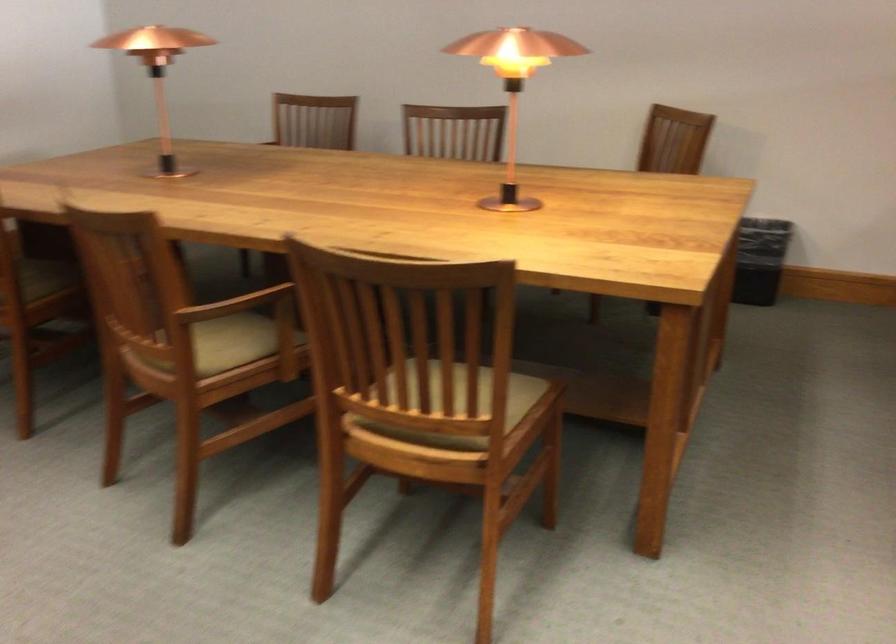
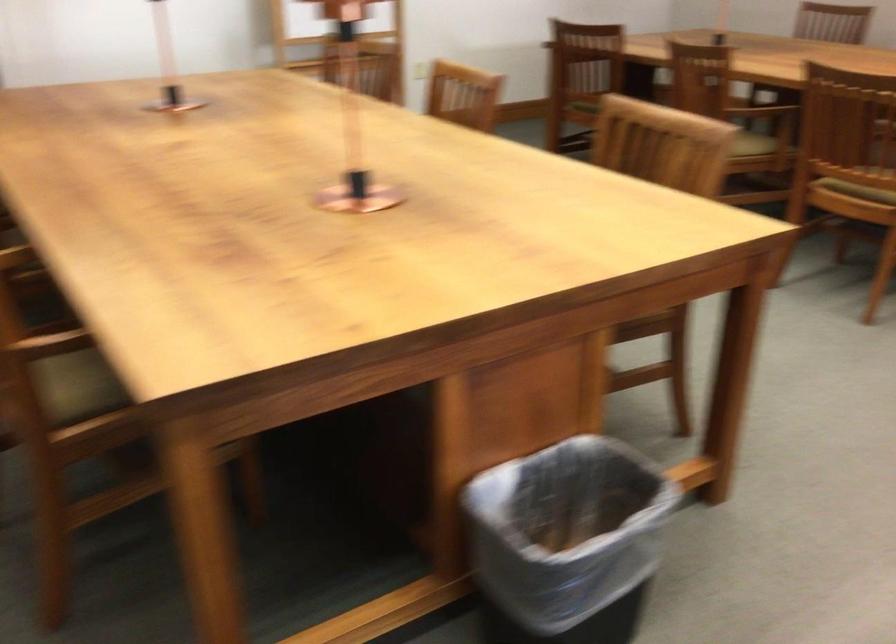
Locate, in the second image, the point that corresponds to pixel 238 384 in the first image.

(753, 144)